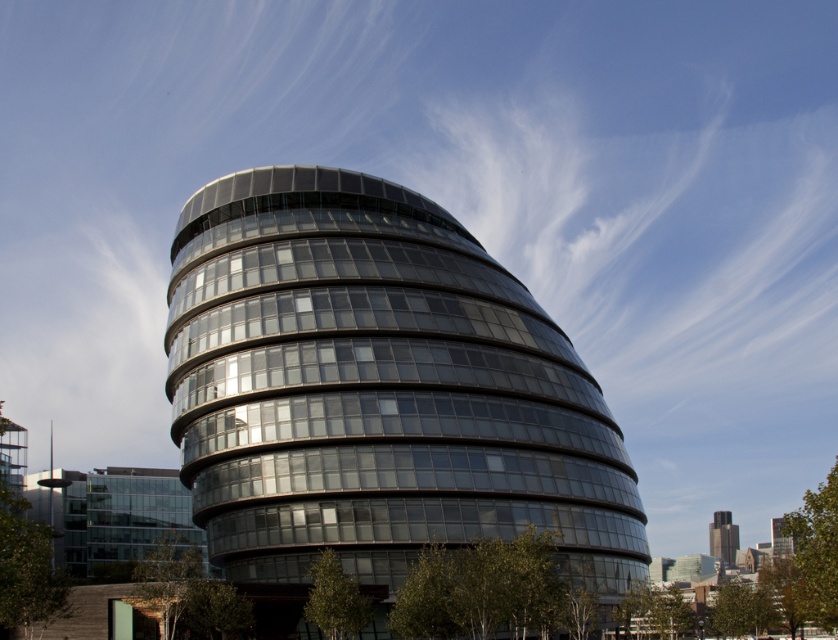
Looking at this image, is transparent glass building at center closer to camera compared to dark gray concrete tower at lower right?

Yes, transparent glass building at center is closer to the viewer.

Which is behind, point (215, 556) or point (720, 540)?

Positioned behind is point (720, 540).

Find the location of a particular element. This screenshot has width=838, height=640. transparent glass building at center is located at coordinates (376, 392).